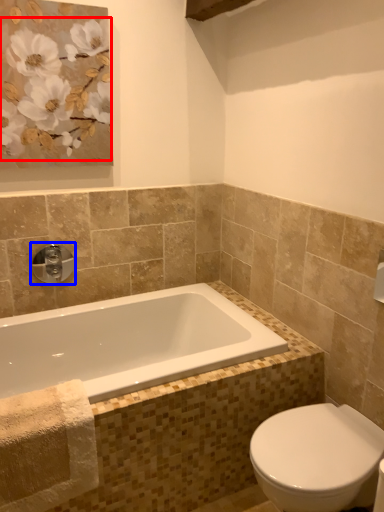
Question: Which object is closer to the camera taking this photo, flower (highlighted by a red box) or tap (highlighted by a blue box)?

Choices:
 (A) flower
 (B) tap

Answer: (A)